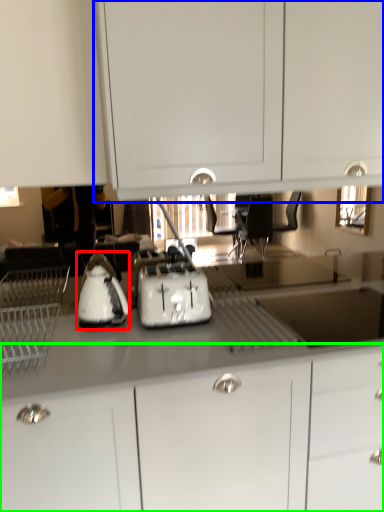
Question: Considering the real-world distances, which object is farthest from kitchen appliance (highlighted by a red box)? cabinetry (highlighted by a blue box) or cabinetry (highlighted by a green box)?

Choices:
 (A) cabinetry
 (B) cabinetry

Answer: (A)